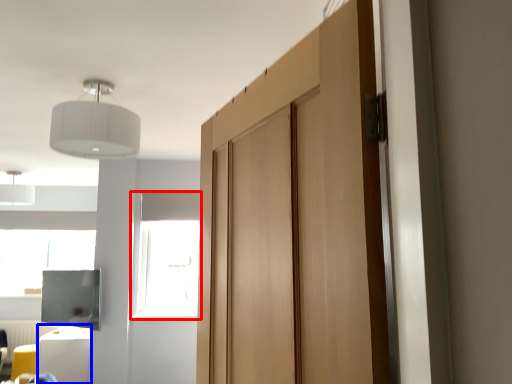
Question: Which object appears closest to the camera in this image, window (highlighted by a red box) or furniture (highlighted by a blue box)?

Choices:
 (A) window
 (B) furniture

Answer: (B)